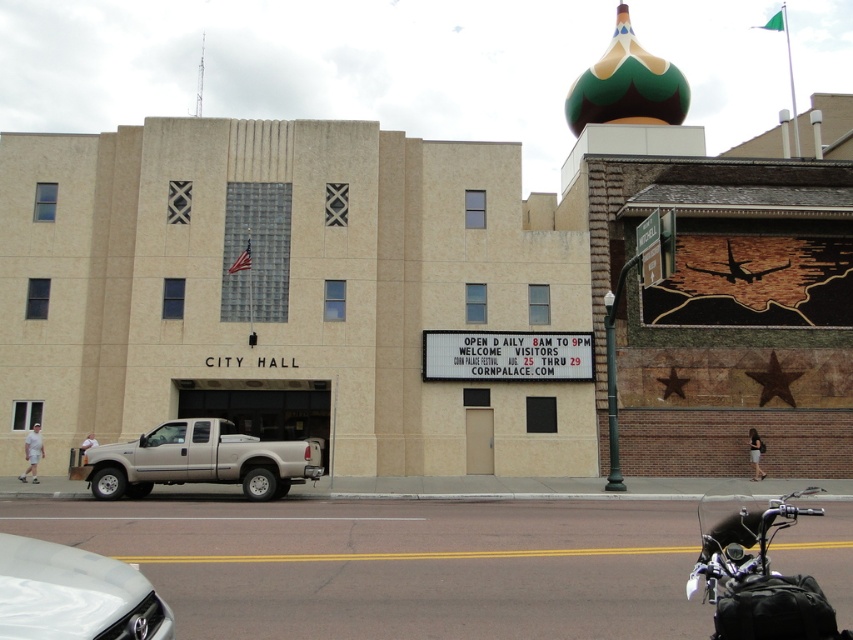
Is point (28, 598) farther from viewer compared to point (300, 474)?

No, (28, 598) is closer to viewer.

Between white glossy car at lower left and silver metallic truck at center-left, which one has more height?

Standing taller between the two is silver metallic truck at center-left.

At what (x,y) coordinates should I click in order to perform the action: click on white glossy car at lower left. Please return your answer as a coordinate pair (x, y). Image resolution: width=853 pixels, height=640 pixels. Looking at the image, I should click on (74, 595).

Where is `white glossy car at lower left`? This screenshot has height=640, width=853. white glossy car at lower left is located at coordinates (74, 595).

Is black textured motorcycle at lower right shorter than silver metallic truck at center-left?

No, black textured motorcycle at lower right is not shorter than silver metallic truck at center-left.

Is point (744, 637) more distant than point (231, 429)?

That is False.

At what (x,y) coordinates should I click in order to perform the action: click on black textured motorcycle at lower right. Please return your answer as a coordinate pair (x, y). The image size is (853, 640). Looking at the image, I should click on (756, 572).

Between black textured motorcycle at lower right and white glossy car at lower left, which one is positioned lower?

black textured motorcycle at lower right is lower down.

Who is more forward, (x=730, y=573) or (x=107, y=637)?

Point (x=107, y=637) is in front.

Where is `black textured motorcycle at lower right`? This screenshot has height=640, width=853. black textured motorcycle at lower right is located at coordinates (756, 572).